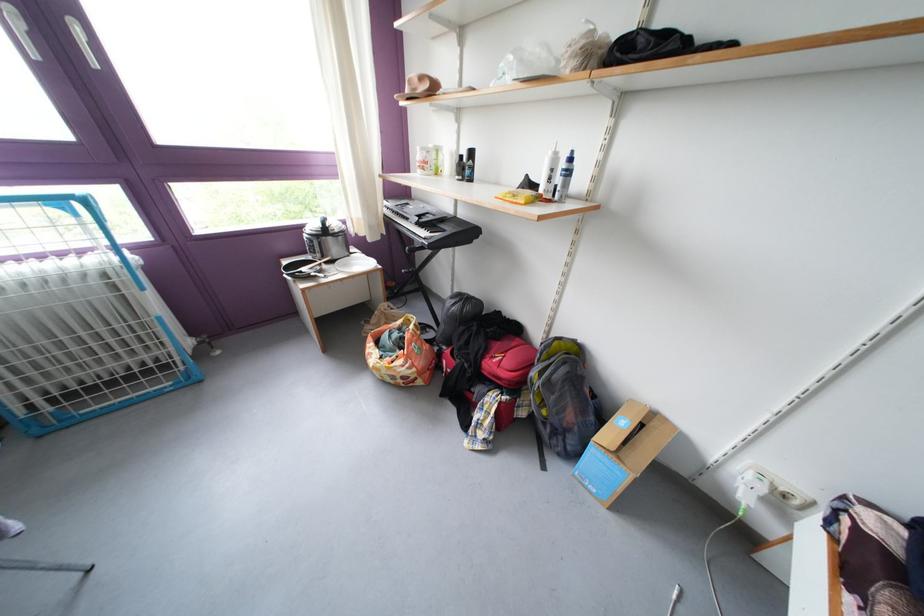
In order to click on keyboard keys in this screenshot , I will do `click(433, 225)`.